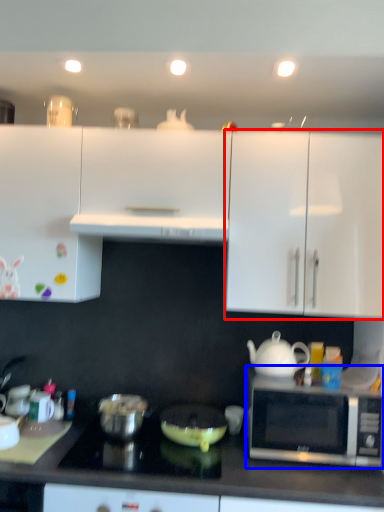
Question: Which of the following is the farthest to the observer, cabinetry (highlighted by a red box) or microwave oven (highlighted by a blue box)?

Choices:
 (A) cabinetry
 (B) microwave oven

Answer: (A)